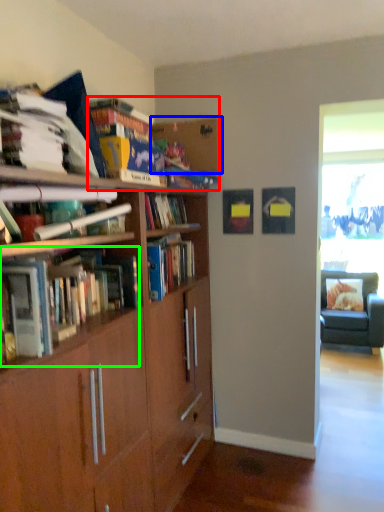
Question: Based on their relative distances, which object is nearer to book (highlighted by a red box)? Choose from shelf (highlighted by a blue box) and book (highlighted by a green box).

Choices:
 (A) shelf
 (B) book

Answer: (A)